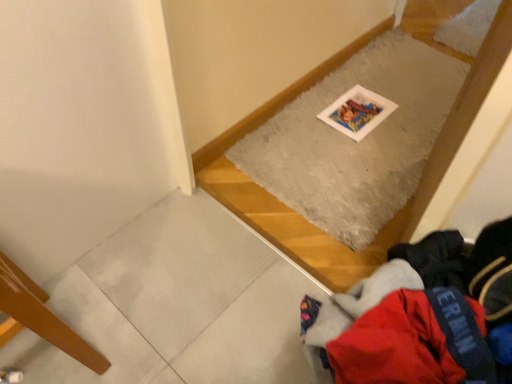
This screenshot has width=512, height=384. What do you see at coordinates (420, 316) in the screenshot?
I see `red fleece jacket at lower right` at bounding box center [420, 316].

What do you see at coordinates (355, 141) in the screenshot? I see `gray fluffy mat at upper center` at bounding box center [355, 141].

Identify the location of wooden floorboard at lower left. The width and height of the screenshot is (512, 384). click(42, 316).

From the image's perspective, is wooden floorboard at lower left on red fleece jacket at lower right?

No, from the image's perspective, wooden floorboard at lower left is not above red fleece jacket at lower right.

Find the location of a particular element. This screenshot has width=512, height=384. furniture on the left of red fleece jacket at lower right is located at coordinates click(x=42, y=316).

Considering the relative positions of wooden floorboard at lower left and red fleece jacket at lower right in the image provided, is wooden floorboard at lower left behind red fleece jacket at lower right?

Yes, wooden floorboard at lower left is behind red fleece jacket at lower right.

Is wooden floorboard at lower left completely or partially outside of red fleece jacket at lower right?

wooden floorboard at lower left lies outside red fleece jacket at lower right's area.

Which is in front, wooden floorboard at lower left or gray fluffy mat at upper center?

wooden floorboard at lower left is more forward.

Is point (92, 352) closer to camera compared to point (377, 83)?

That is True.

In order to click on mat lying above the wooden floorboard at lower left (from the image's perspective) in this screenshot , I will do `click(355, 141)`.

Is red fleece jacket at lower right outside of gray fluffy mat at upper center?

red fleece jacket at lower right is positioned outside gray fluffy mat at upper center.

Is red fleece jacket at lower right with gray fluffy mat at upper center?

They are not placed beside each other.

Is red fleece jacket at lower right further to camera compared to gray fluffy mat at upper center?

No, red fleece jacket at lower right is closer to the camera.

Looking at this image, which of these two, red fleece jacket at lower right or gray fluffy mat at upper center, is wider?

gray fluffy mat at upper center.

Who is bigger, gray fluffy mat at upper center or red fleece jacket at lower right?

red fleece jacket at lower right is bigger.

Considering their positions, is gray fluffy mat at upper center located in front of or behind red fleece jacket at lower right?

gray fluffy mat at upper center is positioned farther from the viewer than red fleece jacket at lower right.

Does gray fluffy mat at upper center turn towards red fleece jacket at lower right?

No.

Would you say gray fluffy mat at upper center is inside or outside red fleece jacket at lower right?

gray fluffy mat at upper center lies outside red fleece jacket at lower right.

Would you say red fleece jacket at lower right is inside or outside wooden floorboard at lower left?

red fleece jacket at lower right is not enclosed by wooden floorboard at lower left.

Is point (393, 247) positioned before point (21, 324)?

No, it is not.

Is red fleece jacket at lower right oriented away from wooden floorboard at lower left?

red fleece jacket at lower right does not have its back to wooden floorboard at lower left.

Is gray fluffy mat at upper center aimed at wooden floorboard at lower left?

No, gray fluffy mat at upper center is not turned towards wooden floorboard at lower left.

Would you say gray fluffy mat at upper center is a long distance from wooden floorboard at lower left?

gray fluffy mat at upper center is positioned a significant distance from wooden floorboard at lower left.

Considering the relative sizes of gray fluffy mat at upper center and wooden floorboard at lower left in the image provided, is gray fluffy mat at upper center smaller than wooden floorboard at lower left?

Correct, gray fluffy mat at upper center occupies less space than wooden floorboard at lower left.

In the image, there is a wooden floorboard at lower left. What are the coordinates of `clothing above it (from the image's perspective)` in the screenshot? It's located at (420, 316).

Locate an element on the screen. The image size is (512, 384). mat behind the wooden floorboard at lower left is located at coordinates (355, 141).

Based on their spatial positions, is wooden floorboard at lower left or red fleece jacket at lower right further from gray fluffy mat at upper center?

The object further to gray fluffy mat at upper center is wooden floorboard at lower left.

Based on their spatial positions, is gray fluffy mat at upper center or wooden floorboard at lower left further from red fleece jacket at lower right?

gray fluffy mat at upper center is further to red fleece jacket at lower right.

Looking at the image, which one is located closer to gray fluffy mat at upper center, red fleece jacket at lower right or wooden floorboard at lower left?

red fleece jacket at lower right.

Based on their spatial positions, is red fleece jacket at lower right or gray fluffy mat at upper center further from wooden floorboard at lower left?

gray fluffy mat at upper center is positioned further to the anchor wooden floorboard at lower left.

Based on their spatial positions, is gray fluffy mat at upper center or red fleece jacket at lower right further from wooden floorboard at lower left?

Among the two, gray fluffy mat at upper center is located further to wooden floorboard at lower left.

Looking at the image, which one is located further to red fleece jacket at lower right, wooden floorboard at lower left or gray fluffy mat at upper center?

gray fluffy mat at upper center is positioned further to the anchor red fleece jacket at lower right.

This screenshot has width=512, height=384. In order to click on furniture between red fleece jacket at lower right and gray fluffy mat at upper center in the front-back direction in this screenshot , I will do `click(42, 316)`.